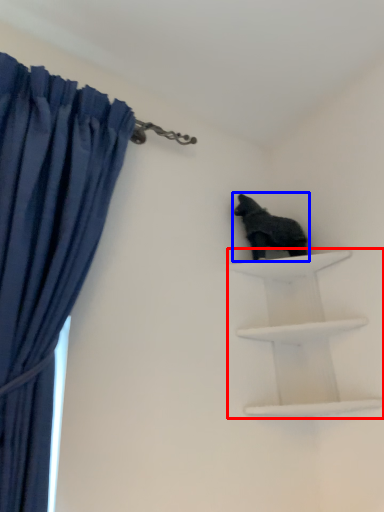
Question: Which point is further to the camera, shelf (highlighted by a red box) or animal (highlighted by a blue box)?

Choices:
 (A) shelf
 (B) animal

Answer: (B)